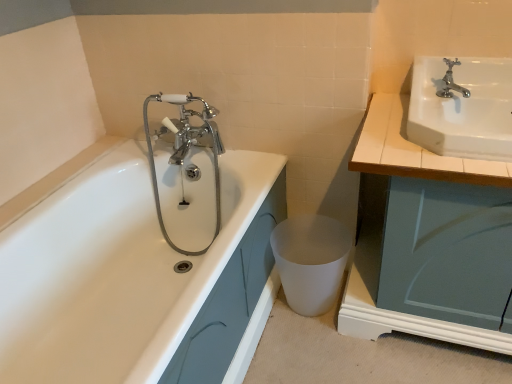
Question: Considering the positions of point (398, 145) and point (305, 279), is point (398, 145) closer or farther from the camera than point (305, 279)?

Choices:
 (A) closer
 (B) farther

Answer: (A)

Question: Is white glossy cabinet at right in front of or behind white matte toilet bowl at lower center in the image?

Choices:
 (A) front
 (B) behind

Answer: (A)

Question: Based on their relative distances, which object is nearer to the white matte toilet bowl at lower center?

Choices:
 (A) white glossy sink at upper right
 (B) polished chrome faucet at upper right
 (C) white glossy cabinet at right
 (D) white glossy bathtub at left

Answer: (D)

Question: Estimate the real-world distances between objects in this image. Which object is closer to the white glossy sink at upper right?

Choices:
 (A) polished chrome faucet at upper right
 (B) white glossy bathtub at left
 (C) white glossy cabinet at right
 (D) white matte toilet bowl at lower center

Answer: (C)